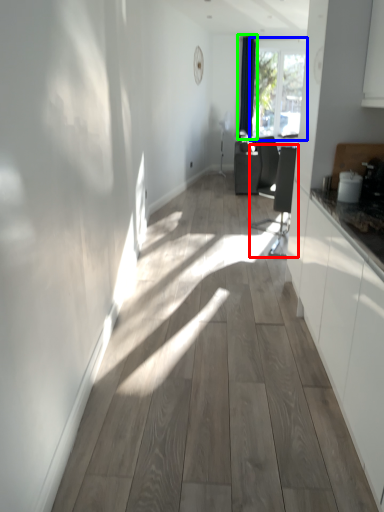
Question: Which object is positioned farthest from swivel chair (highlighted by a red box)? Select from window (highlighted by a blue box) and curtain (highlighted by a green box).

Choices:
 (A) window
 (B) curtain

Answer: (A)